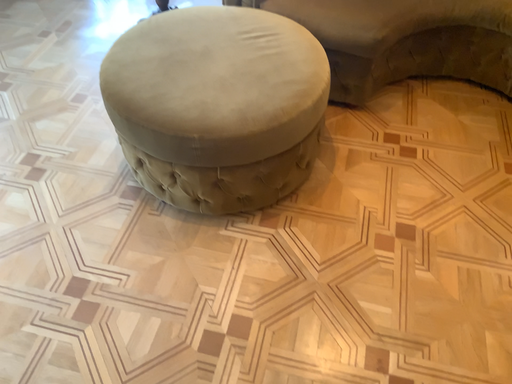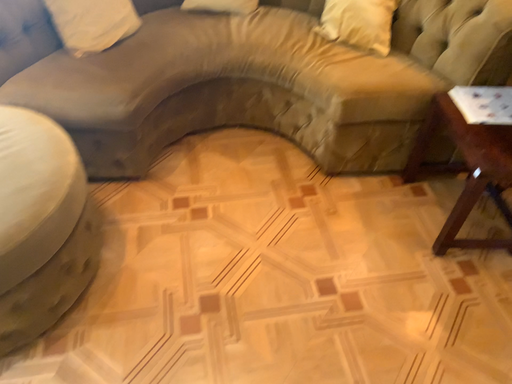
Question: How did the camera likely rotate when shooting the video?

Choices:
 (A) rotated left
 (B) rotated right

Answer: (B)